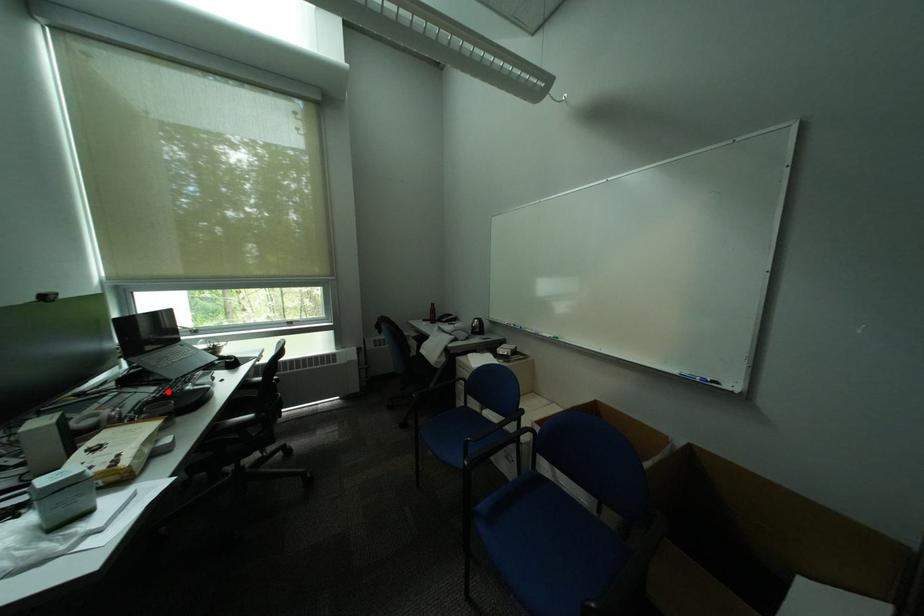
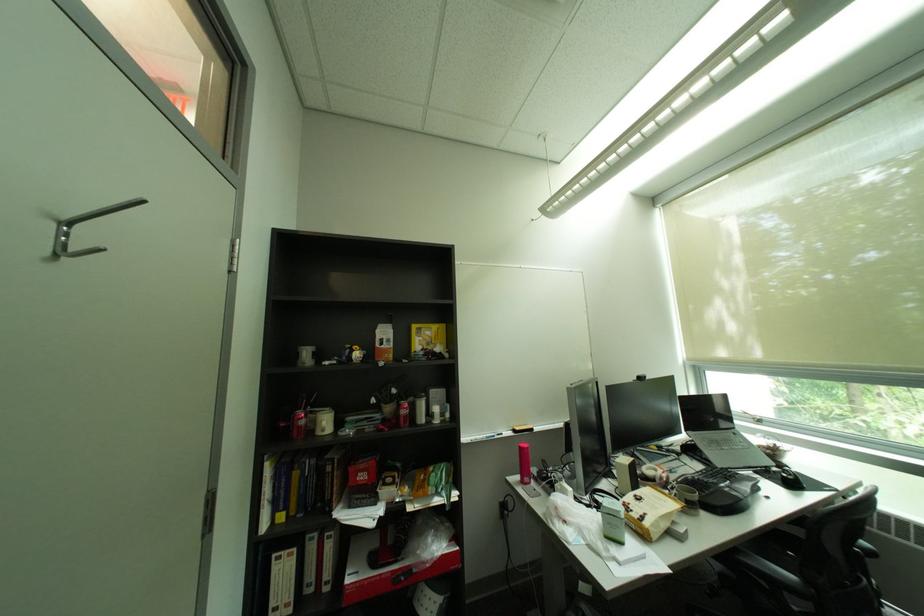
Where in the second image is the point corresponding to the highlighted location from the first image?

(712, 472)